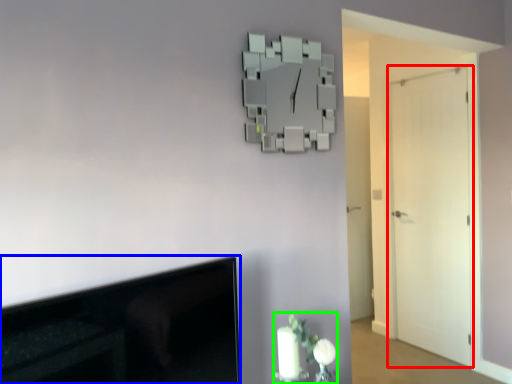
Question: Which object is positioned closest to door (highlighted by a red box)? Select from television (highlighted by a blue box) and floral arrangement (highlighted by a green box).

Choices:
 (A) television
 (B) floral arrangement

Answer: (B)